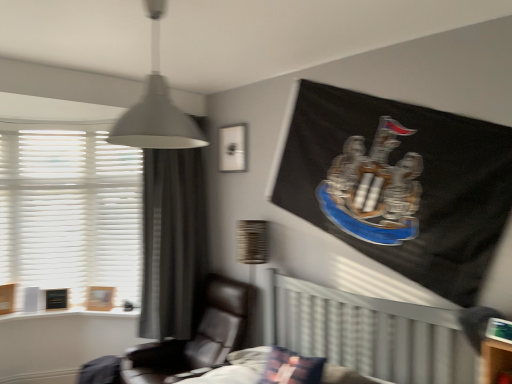
Find the location of a particular element. Image resolution: width=512 pixels, height=384 pixels. vacant point to the left of wooden frame at lower left, positioned as the first picture frame in left-to-right order is located at coordinates (79, 309).